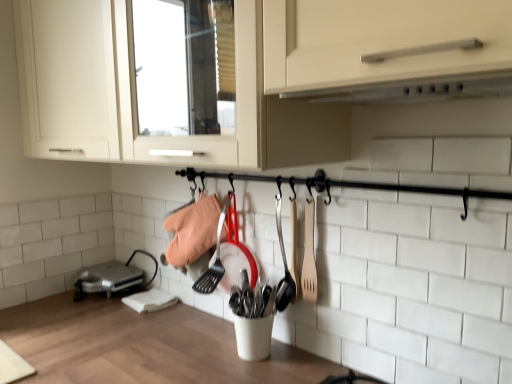
Question: Considering the relative sizes of wooden spatula at center-right and wooden spoon at center-right in the image provided, is wooden spatula at center-right shorter than wooden spoon at center-right?

Choices:
 (A) no
 (B) yes

Answer: (B)

Question: Would you say wooden spoon at center-right is part of wooden spatula at center-right's contents?

Choices:
 (A) yes
 (B) no

Answer: (B)

Question: Is wooden spatula at center-right in contact with wooden spoon at center-right?

Choices:
 (A) yes
 (B) no

Answer: (A)

Question: Can you confirm if wooden spatula at center-right is smaller than wooden spoon at center-right?

Choices:
 (A) no
 (B) yes

Answer: (A)

Question: Does wooden spatula at center-right turn towards wooden spoon at center-right?

Choices:
 (A) yes
 (B) no

Answer: (B)

Question: Would you say wooden spoon at center-right is to the left or to the right of white matte exhaust hood at upper center in the picture?

Choices:
 (A) right
 (B) left

Answer: (B)

Question: In terms of height, does wooden spoon at center-right look taller or shorter compared to white matte exhaust hood at upper center?

Choices:
 (A) short
 (B) tall

Answer: (B)

Question: Looking at the image, does wooden spoon at center-right seem bigger or smaller compared to white matte exhaust hood at upper center?

Choices:
 (A) small
 (B) big

Answer: (A)

Question: Is point (278, 309) closer or farther from the camera than point (362, 89)?

Choices:
 (A) farther
 (B) closer

Answer: (A)

Question: Would you say white matte exhaust hood at upper center is to the left or to the right of silver metallic toaster at lower left in the picture?

Choices:
 (A) right
 (B) left

Answer: (A)

Question: From a real-world perspective, relative to silver metallic toaster at lower left, is white matte exhaust hood at upper center vertically above or below?

Choices:
 (A) above
 (B) below

Answer: (A)

Question: Considering the positions of white matte exhaust hood at upper center and silver metallic toaster at lower left in the image, is white matte exhaust hood at upper center wider or thinner than silver metallic toaster at lower left?

Choices:
 (A) wide
 (B) thin

Answer: (A)

Question: Relative to silver metallic toaster at lower left, is white matte exhaust hood at upper center in front or behind?

Choices:
 (A) behind
 (B) front

Answer: (B)

Question: Looking at their shapes, would you say wooden spoon at center-right is wider or thinner than wooden spatula at center-right?

Choices:
 (A) thin
 (B) wide

Answer: (A)

Question: From a real-world perspective, is wooden spoon at center-right above or below wooden spatula at center-right?

Choices:
 (A) below
 (B) above

Answer: (A)